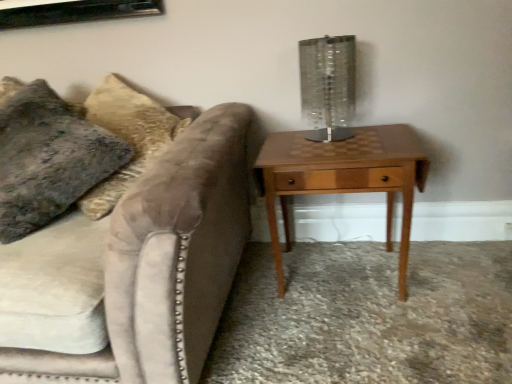
Question: From a real-world perspective, relative to woodenmaterial/texturenightstand at right, is clear glass table lamp at upper right vertically above or below?

Choices:
 (A) below
 (B) above

Answer: (B)

Question: From their relative heights in the image, would you say clear glass table lamp at upper right is taller or shorter than woodenmaterial/texturenightstand at right?

Choices:
 (A) tall
 (B) short

Answer: (B)

Question: Which object is positioned farthest from the velvet couch at left?

Choices:
 (A) clear glass table lamp at upper right
 (B) velvety gray pillow at left
 (C) woodenmaterial/texturenightstand at right

Answer: (A)

Question: Based on their relative distances, which object is farther from the woodenmaterial/texturenightstand at right?

Choices:
 (A) clear glass table lamp at upper right
 (B) velvety gray pillow at left
 (C) velvet couch at left

Answer: (B)